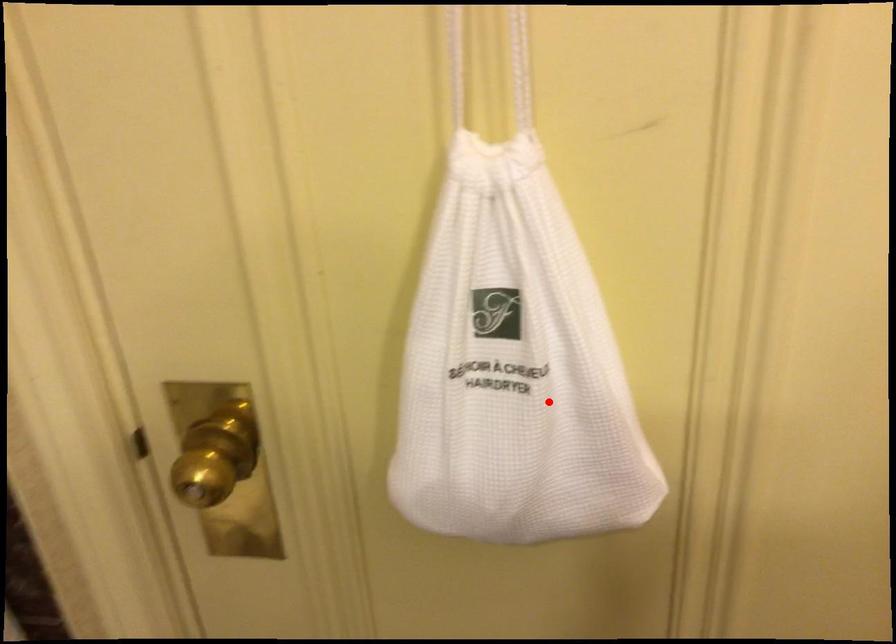
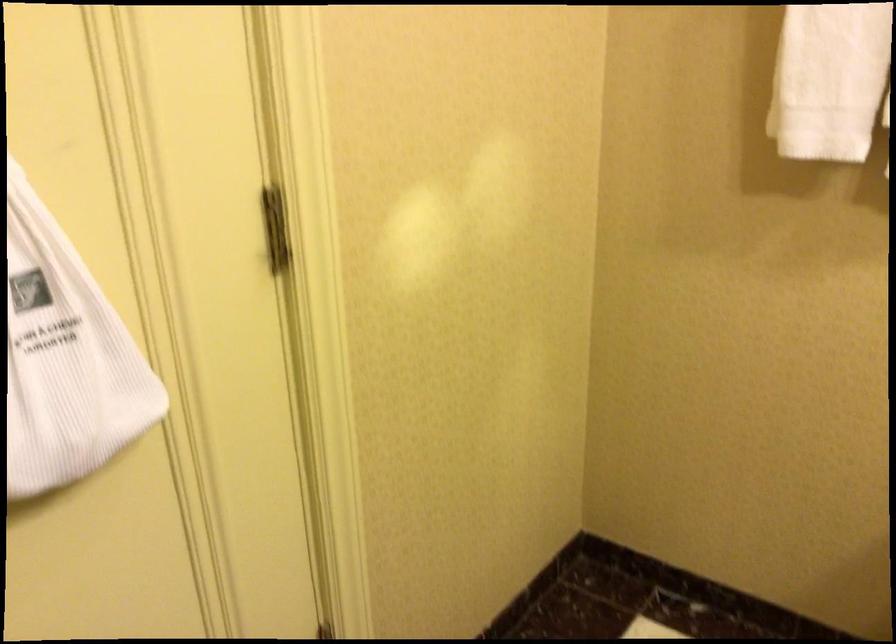
Question: A red point is marked in image1. In image2, is the corresponding 3D point closer to the camera or farther? Reply with the corresponding letter.

Choices:
 (A) The corresponding 3D point is closer.
 (B) The corresponding 3D point is farther.

Answer: (B)